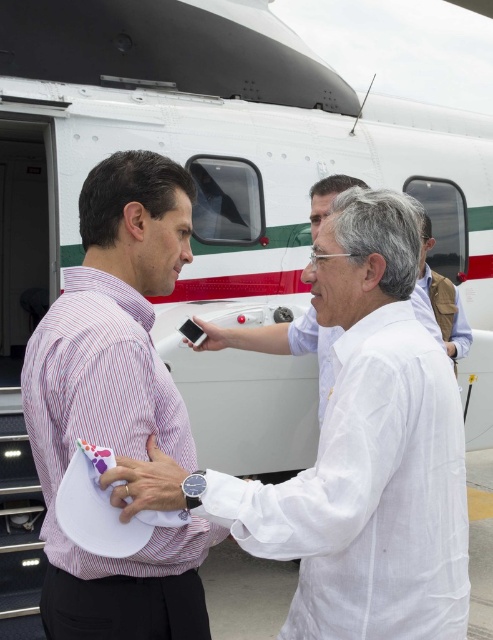
In the scene shown: You are a photographer trying to capture a clear photo of the matte black phone at center without the white cotton shirt at center blocking it. Based on their positions, is this possible?

The white cotton shirt at center is in front of the matte black phone at center, so taking a clear photo of the matte black phone at center without the white cotton shirt at center blocking it would not be possible from the current angle.

You are standing at the origin point in the image. There is a white cotton shirt at center represented by point (367, 452). Which direction should you move to reach the white cotton shirt at center?

The white cotton shirt at center is located at point (367, 452), so you should move towards that coordinate to reach it.

You are a pilot preparing to board the helicopter. You need to place a matte white paper at center and a matte black phone at center in your flight bag. According to the scene, which item is closer to the left side of the bag?

The matte white paper at center is to the left of the matte black phone at center, so the matte white paper at center is closer to the left side of the bag.